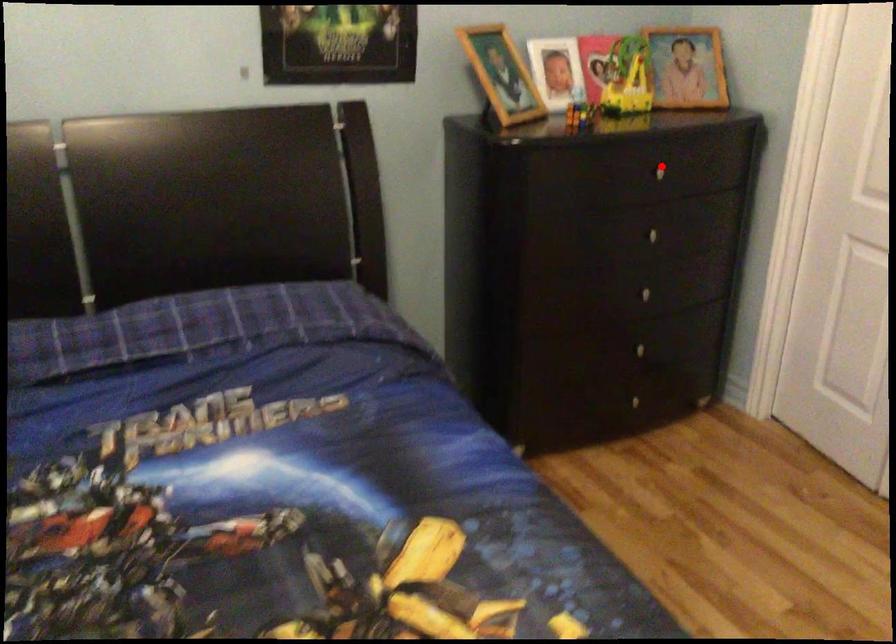
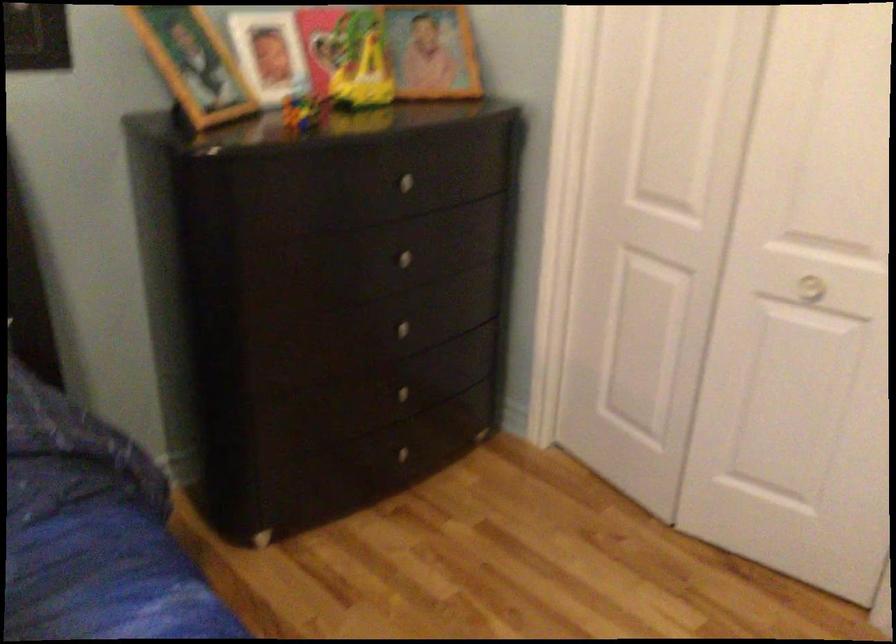
Question: I am providing you with two images of the same scene from different viewpoints. In image1, a red point is highlighted. Considering the same 3D point in image2, which of the following is correct?

Choices:
 (A) It is closer
 (B) It is farther

Answer: (A)